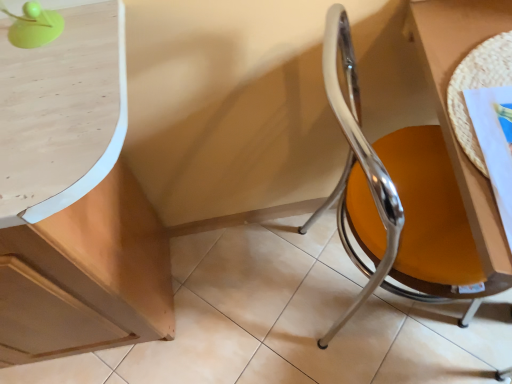
Locate an element on the screen. The height and width of the screenshot is (384, 512). vacant space to the right of green plastic ball at upper left is located at coordinates (93, 32).